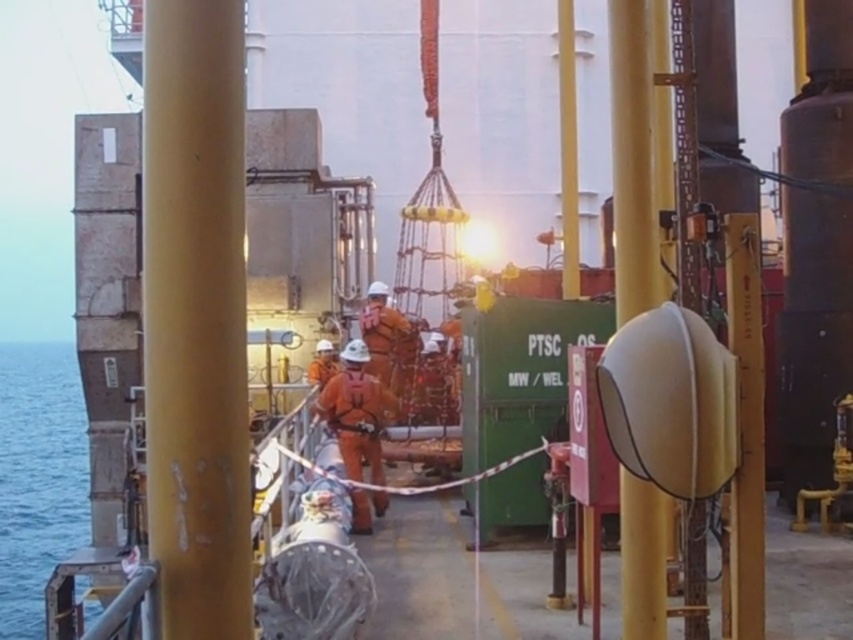
Question: Does blue water at left have a greater width compared to yellow matte/rough pipe at center-right?

Choices:
 (A) no
 (B) yes

Answer: (B)

Question: Which object is the farthest from the orange fabric safety suit at center?

Choices:
 (A) smooth yellow pole at center
 (B) blue water at left
 (C) yellow matte/rough pipe at center-right

Answer: (B)

Question: Among these points, which one is nearest to the camera?

Choices:
 (A) (630, 637)
 (B) (358, 348)

Answer: (A)

Question: Which point is closer to the camera taking this photo?

Choices:
 (A) (344, 380)
 (B) (663, 508)

Answer: (B)

Question: Can you confirm if smooth yellow pole at center is wider than orange fabric safety suit at center?

Choices:
 (A) yes
 (B) no

Answer: (B)

Question: Is blue water at left positioned behind yellow matte/rough pipe at center-right?

Choices:
 (A) no
 (B) yes

Answer: (B)